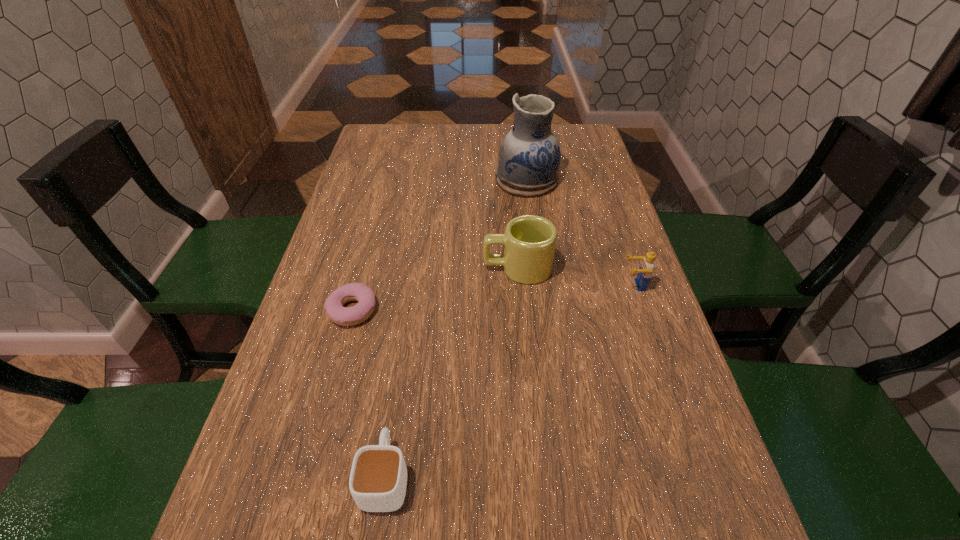
Image resolution: width=960 pixels, height=540 pixels. What are the coordinates of `free region that satisfies the following two spatial constraints: 1. on the back side of the farthest object; 2. on the right side of the shortest object` in the screenshot? It's located at (388, 180).